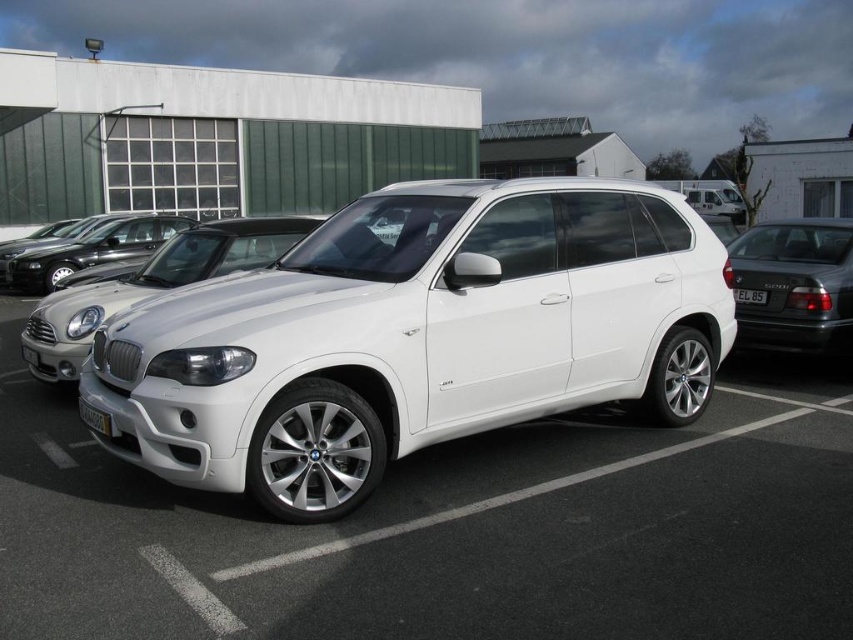
You are a parking attendant and need to guide a driver to park their car between the glossy black car at right and the satin black car at center. According to the scene, where should the driver position their car?

The driver should position their car below the satin black car at center and above the glossy black car at right since the glossy black car at right is below the satin black car at center.

You are a parking attendant and need to guide a driver to park their car between the white metallic car at center and the glossy black car at right. Is there enough space between them for a compact car?

The white metallic car at center is to the left of the glossy black car at right, so there is space between them. A compact car can be parked between the white metallic car at center and the glossy black car at right.

You are a parking attendant checking license plates. You see the yellow plastic license plate at lower center and the white plastic license plate at center. Which license plate is located below the other?

The yellow plastic license plate at lower center is positioned under the white plastic license plate at center, so the yellow one is below the white one.